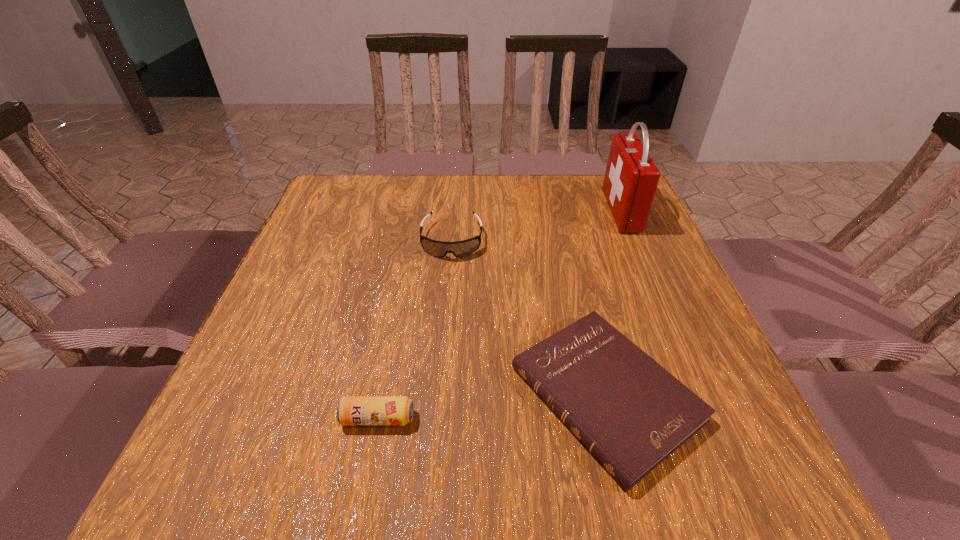
In the image, there is a desktop. At what (x,y) coordinates should I click in order to perform the action: click on free space at the far left corner. Please return your answer as a coordinate pair (x, y). The height and width of the screenshot is (540, 960). Looking at the image, I should click on (368, 190).

This screenshot has width=960, height=540. In the image, there is a desktop. Identify the location of free space at the far right corner. (579, 180).

The width and height of the screenshot is (960, 540). What are the coordinates of `free spot between the goggles and the beer can` in the screenshot? It's located at (415, 329).

The image size is (960, 540). In order to click on free space between the shortest object and the beer can in this screenshot , I will do `click(492, 406)`.

At what (x,y) coordinates should I click in order to perform the action: click on empty location between the shortest object and the beer can. Please return your answer as a coordinate pair (x, y). This screenshot has width=960, height=540. Looking at the image, I should click on (492, 406).

Locate an element on the screen. vacant point located between the hardback book and the beer can is located at coordinates (492, 406).

The height and width of the screenshot is (540, 960). Identify the location of empty space that is in between the goggles and the third tallest object. (415, 329).

What are the coordinates of `vacant space that's between the shortest object and the goggles` in the screenshot? It's located at (529, 318).

Find the location of a particular element. free space that is in between the shortest object and the goggles is located at coordinates (529, 318).

I want to click on free spot between the hardback book and the second shortest object, so click(x=492, y=406).